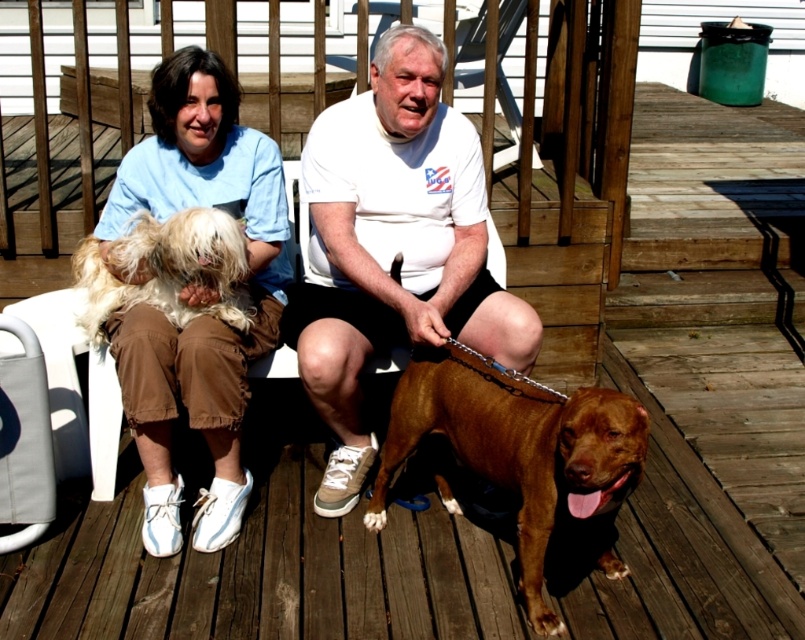
Question: Does light blue cotton shirt at upper left have a greater width compared to fluffy white fur at center?

Choices:
 (A) yes
 (B) no

Answer: (B)

Question: Does white t-shirt at center come behind brown glossy dog at center?

Choices:
 (A) yes
 (B) no

Answer: (A)

Question: Does light blue cotton shirt at upper left appear under fluffy white fur at center?

Choices:
 (A) no
 (B) yes

Answer: (B)

Question: Which is farther from the white t-shirt at center?

Choices:
 (A) brown glossy dog at center
 (B) light blue cotton shirt at upper left

Answer: (A)

Question: Which of the following is the closest to the observer?

Choices:
 (A) fluffy white fur at center
 (B) white t-shirt at center
 (C) brown glossy dog at center

Answer: (C)

Question: Estimate the real-world distances between objects in this image. Which object is closer to the white t-shirt at center?

Choices:
 (A) brown glossy dog at center
 (B) fluffy white fur at center
 (C) light blue cotton shirt at upper left

Answer: (C)